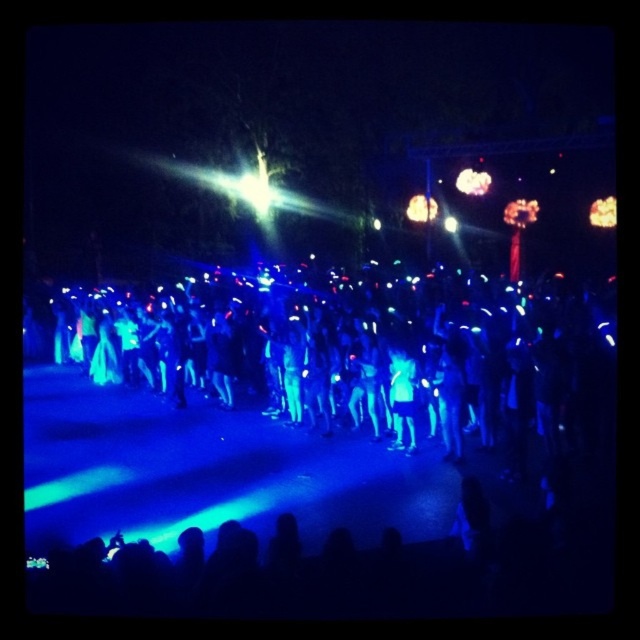
From the picture: Is the position of blue glowing sticks at center less distant than that of matte white light at center?

Yes, it is in front of matte white light at center.

Is point (611, 353) positioned behind point (417, 196)?

No, (611, 353) is closer to viewer.

At what (x,y) coordinates should I click in order to perform the action: click on blue glowing sticks at center. Please return your answer as a coordinate pair (x, y). Looking at the image, I should click on (376, 353).

Can you confirm if translucent amber light at upper right is positioned below matte white light at center?

Yes, translucent amber light at upper right is below matte white light at center.

Consider the image. Is translucent amber light at upper right positioned behind matte white light at center?

No.

Who is more distant from viewer, (x=593, y=225) or (x=406, y=205)?

The point (x=406, y=205) is more distant.

This screenshot has width=640, height=640. I want to click on translucent amber light at upper right, so click(602, 212).

Is blue glowing sticks at center thinner than translucent amber light at upper right?

In fact, blue glowing sticks at center might be wider than translucent amber light at upper right.

Who is shorter, blue glowing sticks at center or translucent amber light at upper right?

translucent amber light at upper right

Is point (332, 400) positioned behind point (609, 202)?

No, (332, 400) is in front of (609, 202).

I want to click on blue glowing sticks at center, so click(x=376, y=353).